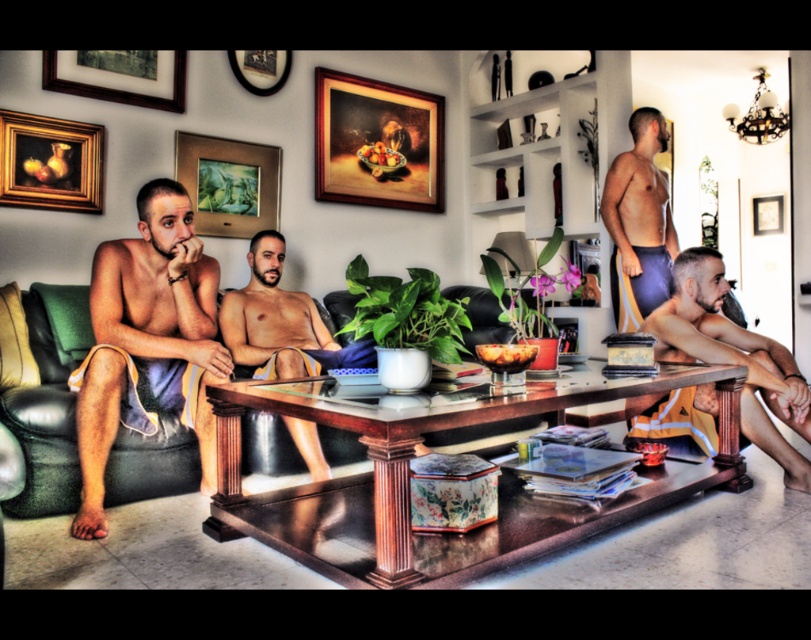
Question: Does matte yellow shorts at right appear on the left side of matte purple shorts at right?

Choices:
 (A) no
 (B) yes

Answer: (B)

Question: Which of the following is the farthest from the observer?

Choices:
 (A) wooden picture frame at upper center
 (B) matte yellow shorts at right

Answer: (A)

Question: Is matte towel at left positioned behind gold-framed painting of fruits at upper left?

Choices:
 (A) yes
 (B) no

Answer: (B)

Question: Which point is farther to the camera?

Choices:
 (A) gold-framed painting of fruits at upper left
 (B) matte purple shorts at right
 (C) gold-framed picture at upper center

Answer: (B)

Question: Based on their relative distances, which object is farther from the matte towel at left?

Choices:
 (A) wooden picture frame at upper left
 (B) matte yellow shorts at right

Answer: (B)

Question: Is matte yellow shorts at right bigger than gold-framed painting of fruits at upper left?

Choices:
 (A) yes
 (B) no

Answer: (A)